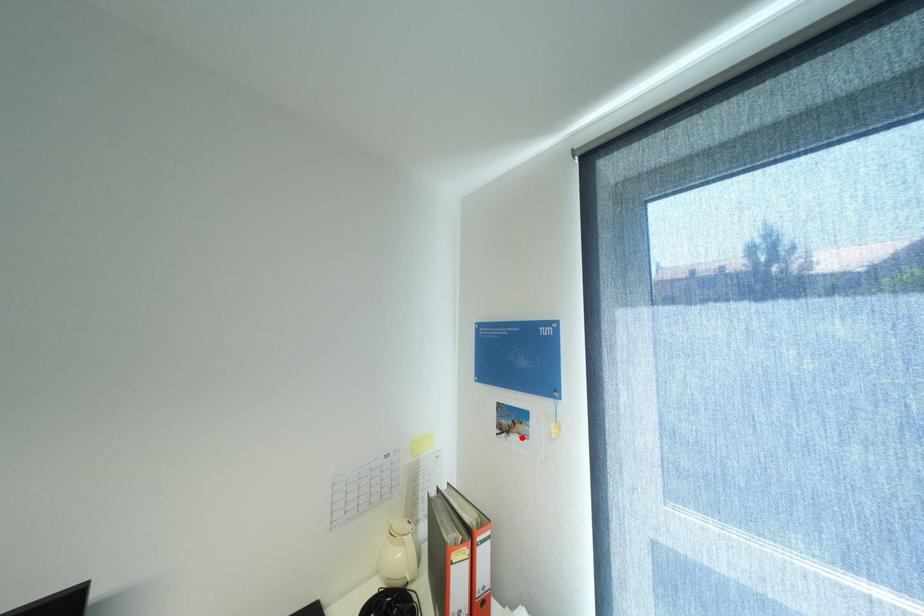
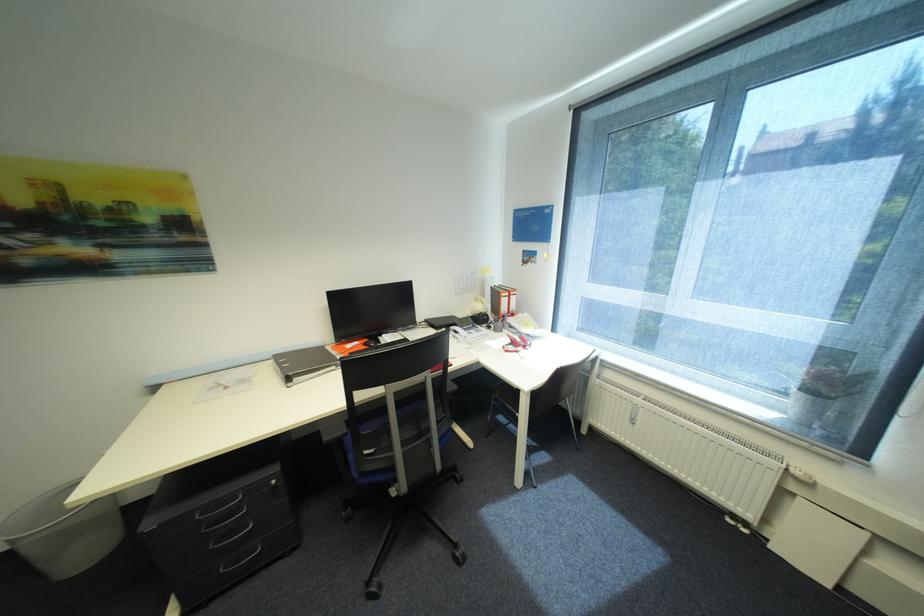
The point at the highlighted location is marked in the first image. Where is the corresponding point in the second image?

(537, 265)